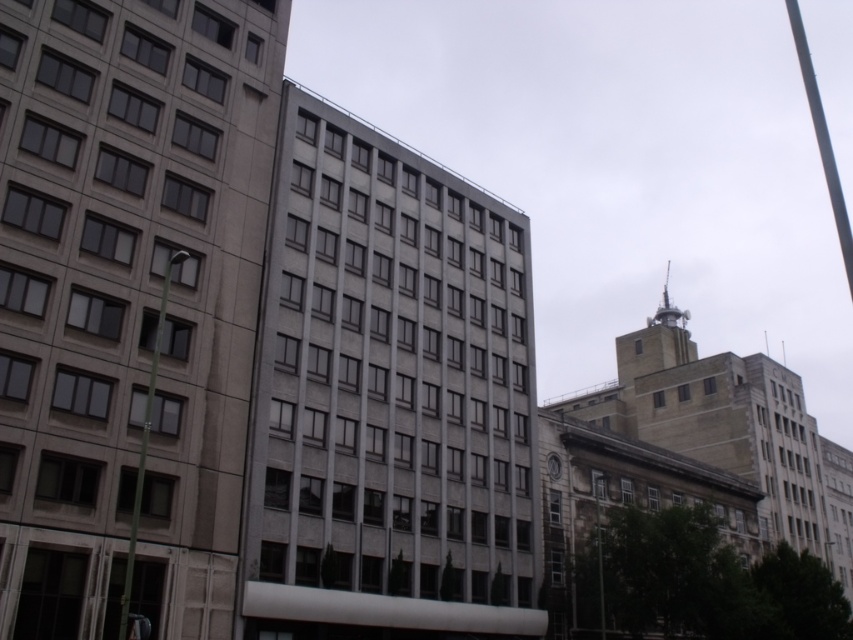
Question: Which of these objects is positioned farthest from the green metallic pole at left?

Choices:
 (A) gray concrete building at center
 (B) gray concrete building at left

Answer: (A)

Question: Can you confirm if gray concrete building at left is positioned to the right of white marble clock at center?

Choices:
 (A) yes
 (B) no

Answer: (B)

Question: Among these points, which one is nearest to the camera?

Choices:
 (A) (221, 202)
 (B) (142, 428)
 (C) (555, 477)
 (D) (804, 49)

Answer: (B)

Question: Estimate the real-world distances between objects in this image. Which object is farther from the white marble clock at center?

Choices:
 (A) gray concrete building at center
 (B) smooth gray pole at upper right
 (C) gray concrete building at left

Answer: (B)

Question: Does smooth gray pole at upper right have a larger size compared to green metallic pole at left?

Choices:
 (A) yes
 (B) no

Answer: (A)

Question: Does gray concrete building at left appear over green metallic pole at left?

Choices:
 (A) no
 (B) yes

Answer: (B)